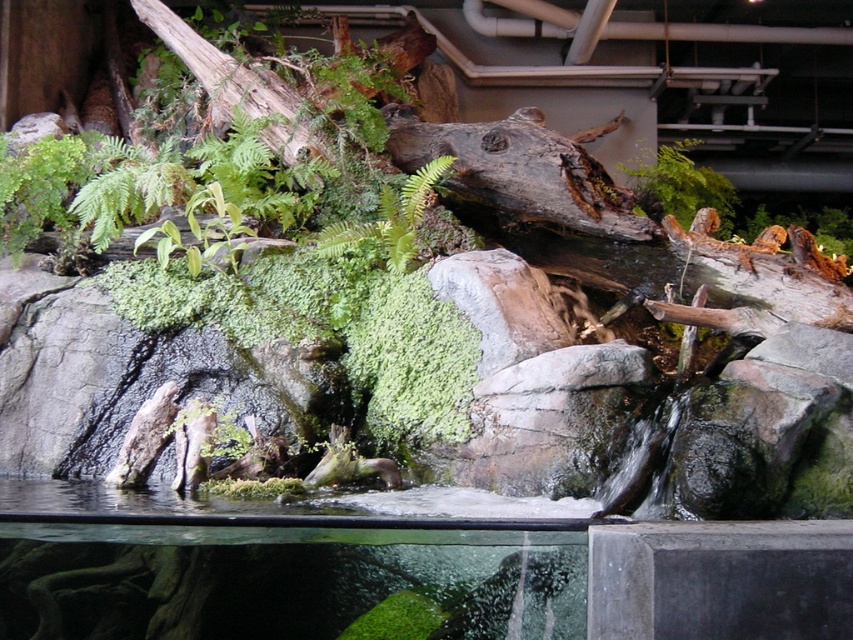
You are setting up a terrarium and need to place the green mossy plant at upper center and the green fuzzy fern at center. According to the layout, which plant should be placed to the right of the other?

The green mossy plant at upper center should be placed to the right of the green fuzzy fern at center because the green mossy plant at upper center is positioned on the right side of green fuzzy fern at center.

Looking at the miniature forested area in the terrarium, which of the two plants, the green fuzzy fern at upper left or the green mossy plant at upper center, is shorter?

The green fuzzy fern at upper left is shorter than the green mossy plant at upper center.

You are navigating through a miniature forested terrarium and want to move from the point at coordinates point (409, 227) to the point at coordinates point (210, 244). Which direction should you move to reach your destination?

To move from point (409, 227) to point (210, 244), you should move downward because point (409, 227) is in front of point (210, 244), indicating it is closer to the viewer and thus higher in the visual plane.